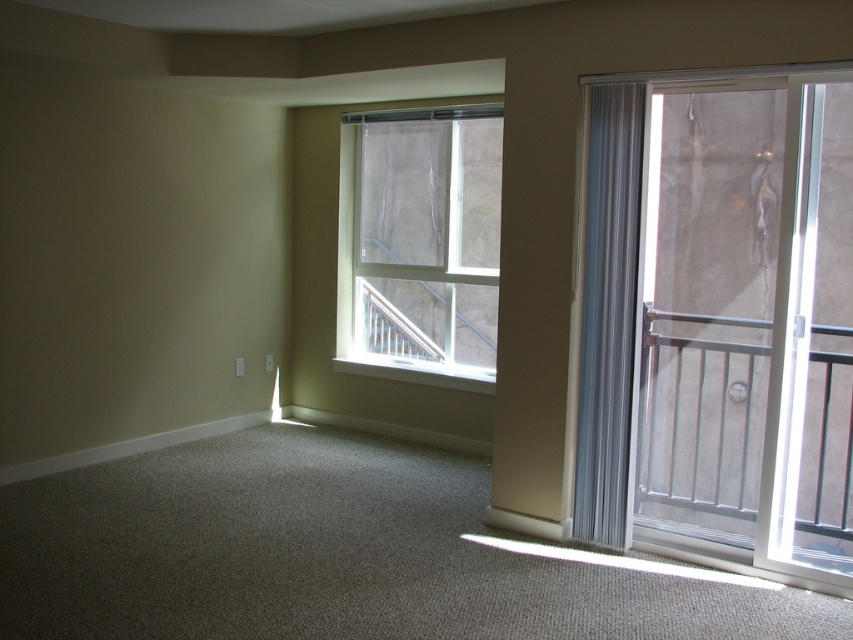
Question: Is clear glass window at upper center positioned in front of gray sheer curtain at right?

Choices:
 (A) no
 (B) yes

Answer: (A)

Question: Which object is closer to the camera taking this photo?

Choices:
 (A) gray sheer curtain at right
 (B) clear glass door at right

Answer: (B)

Question: Is clear glass door at right wider than clear glass window at upper center?

Choices:
 (A) yes
 (B) no

Answer: (A)

Question: Which object is closer to the camera taking this photo?

Choices:
 (A) clear glass window at upper center
 (B) gray sheer curtain at right

Answer: (B)

Question: Which point appears farthest from the camera in this image?

Choices:
 (A) (375, 204)
 (B) (844, 83)
 (C) (610, 129)

Answer: (A)

Question: Can you confirm if clear glass door at right is smaller than clear glass window at upper center?

Choices:
 (A) no
 (B) yes

Answer: (A)